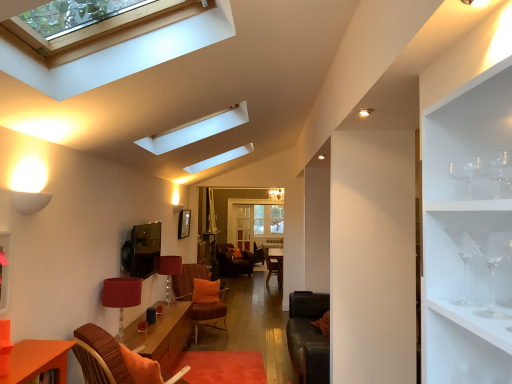
Question: Is point (218, 288) closer or farther from the camera than point (8, 269)?

Choices:
 (A) farther
 (B) closer

Answer: (A)

Question: Visually, is orange fabric pillow at center positioned to the left or to the right of pink matte shelf at left?

Choices:
 (A) left
 (B) right

Answer: (B)

Question: Estimate the real-world distances between objects in this image. Which object is closer to the orange fabric swivel chair at center, placed as the 1th swivel chair when sorted from back to front?

Choices:
 (A) clear glass wine glass at upper right, which is counted as the 3th wine glass, starting from the back
 (B) clear glass skylight at upper center
 (C) orange fabric pillow at center
 (D) smooth orange rug at lower center
 (E) clear glass wine glass at upper right, which is the second wine glass in back-to-front order

Answer: (C)

Question: Estimate the real-world distances between objects in this image. Which object is farther from the orange fabric pillow at center?

Choices:
 (A) velvet orange swivel chair at lower left, placed as the 1th swivel chair when sorted from front to back
 (B) matte red lampshade at center, which appears as the first lamp when viewed from the back
 (C) clear glass wine glass at upper right, acting as the first wine glass starting from the front
 (D) pink matte shelf at left
 (E) matte red lampshade at lower left, the 2th lamp from the back

Answer: (C)